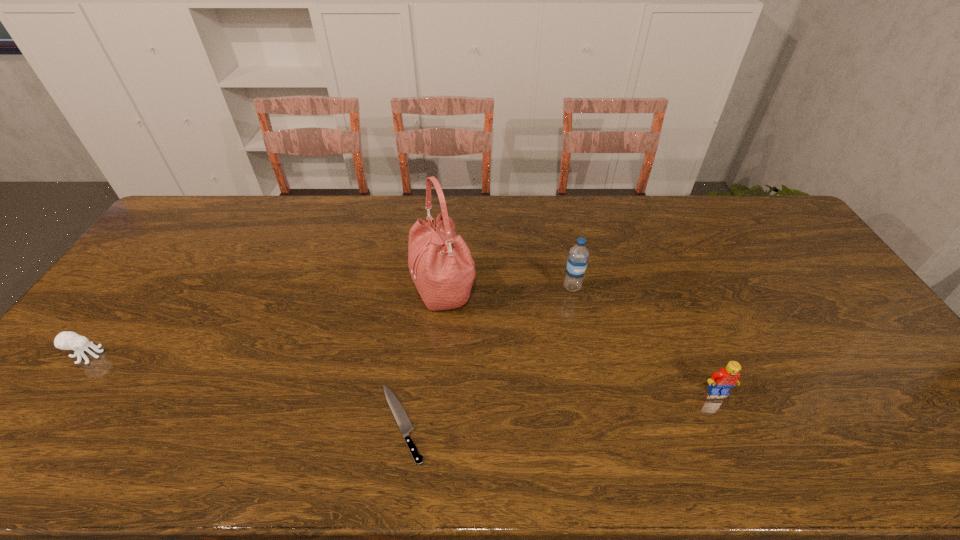
Identify the location of vacant area that lies between the second shortest object and the Lego. (402, 373).

Identify the location of unoccupied position between the handbag and the shortest object. Image resolution: width=960 pixels, height=540 pixels. (422, 356).

Locate an element on the screen. This screenshot has height=540, width=960. free space between the water bottle and the third tallest object is located at coordinates [x=645, y=339].

The image size is (960, 540). I want to click on vacant space that's between the third shortest object and the shortest object, so coord(560,407).

What are the coordinates of `vacant region between the rightmost object and the tallest object` in the screenshot? It's located at (581, 340).

Where is `free space between the handbag and the octopus`? free space between the handbag and the octopus is located at coordinates (266, 322).

The image size is (960, 540). Find the location of `free space between the handbag and the rightmost object`. free space between the handbag and the rightmost object is located at coordinates (581, 340).

Find the location of a particular element. free point between the second shortest object and the second tallest object is located at coordinates (330, 321).

You are a GUI agent. You are given a task and a screenshot of the screen. Output one action in this format:
    pyautogui.click(x=<x>, y=<y>)
    Task: Click on the empty space between the Lego and the leftmost object
    This screenshot has height=540, width=960.
    Given the screenshot: What is the action you would take?
    pyautogui.click(x=402, y=373)

Select which object appears as the third closest to the rightmost object. Please provide its 2D coordinates. Your answer should be formatted as a tuple, i.e. [(x, y)], where the tuple contains the x and y coordinates of a point satisfying the conditions above.

[(402, 419)]